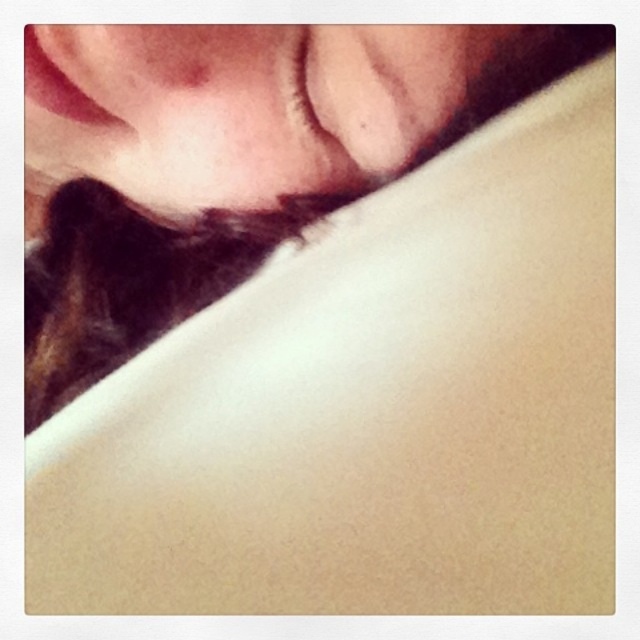
You are holding a 12 inch ruler and want to measure the distance from your eyes to the point at coordinates point (428, 28) in the image. According to the image, can you reach that point with your ruler?

The point point (428, 28) is 12.53 inches away from the viewer. Since your ruler is 12 inches long, it is slightly shorter than the required distance, so you cannot reach the point with your ruler.

In the scene shown: Based on the scene description, which object is positioned higher between the smooth skin at center and the matte skin at upper center?

The smooth skin at center is positioned higher than the matte skin at upper center according to the description.